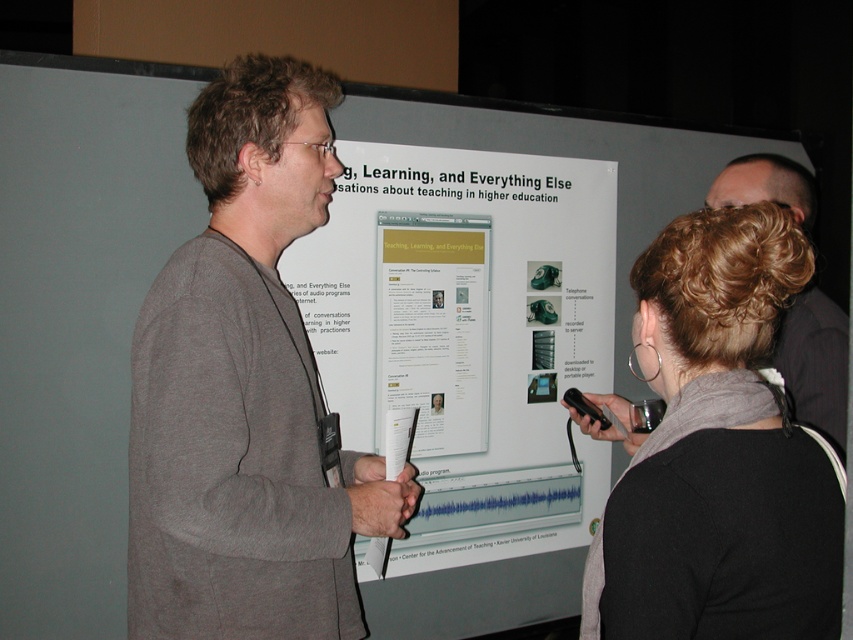
Does white paper poster at center appear on the left side of white paper at center?

No, white paper poster at center is not to the left of white paper at center.

Is white paper poster at center taller than white paper at center?

Yes.

Where is `white paper poster at center`? white paper poster at center is located at coordinates (467, 333).

Image resolution: width=853 pixels, height=640 pixels. What are the coordinates of `white paper poster at center` in the screenshot? It's located at (467, 333).

Which is above, white paper poster at center or dark brown hair at center?

Positioned higher is white paper poster at center.

Is white paper poster at center taller than dark brown hair at center?

Yes, white paper poster at center is taller than dark brown hair at center.

Does point (595, 260) come closer to viewer compared to point (778, 499)?

No, (595, 260) is behind (778, 499).

Image resolution: width=853 pixels, height=640 pixels. What are the coordinates of `white paper poster at center` in the screenshot? It's located at (467, 333).

Is point (398, 269) closer to viewer compared to point (799, 330)?

No, it is not.

The width and height of the screenshot is (853, 640). I want to click on white paper at center, so click(433, 326).

You are a GUI agent. You are given a task and a screenshot of the screen. Output one action in this format:
    pyautogui.click(x=<x>, y=<y>)
    Task: Click on the white paper at center
    The width and height of the screenshot is (853, 640).
    Given the screenshot: What is the action you would take?
    pyautogui.click(x=433, y=326)